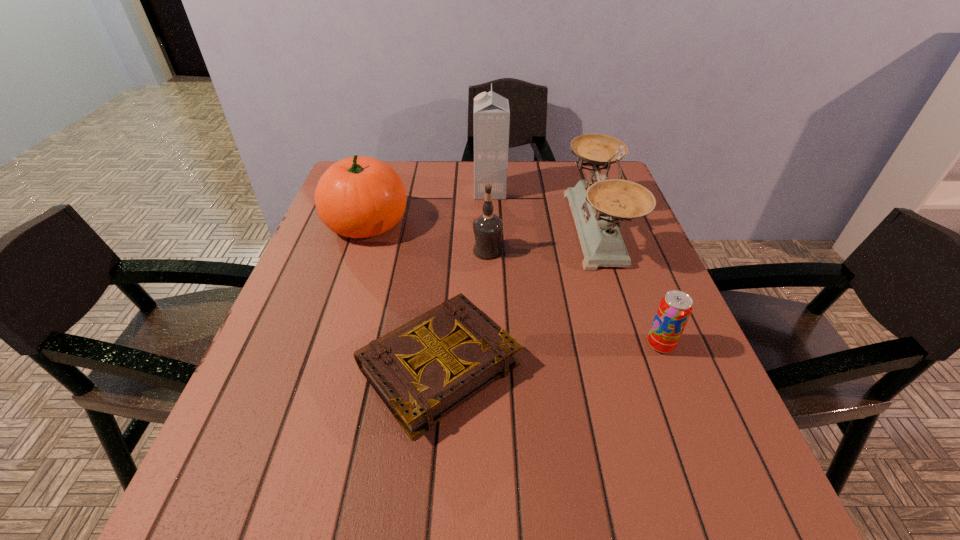
Identify the location of vacant area that lies between the scale and the soda can. (629, 287).

This screenshot has width=960, height=540. What are the coordinates of `free point between the soda can and the scale` in the screenshot? It's located at point(629,287).

Locate an element on the screen. This screenshot has height=540, width=960. free spot between the soda can and the pumpkin is located at coordinates (514, 284).

What are the coordinates of `vacant space in between the pumpkin and the carton` in the screenshot? It's located at (428, 207).

Identify the location of free space between the carton and the scale. This screenshot has height=540, width=960. 543,211.

The height and width of the screenshot is (540, 960). Find the location of `free space between the shortest object and the scale`. free space between the shortest object and the scale is located at coordinates (517, 298).

Identify the location of object that stands as the closest to the second shortest object. This screenshot has height=540, width=960. (598, 207).

Locate which object is the closest to the hardback book. Please provide its 2D coordinates. Your answer should be formatted as a tuple, i.e. [(x, y)], where the tuple contains the x and y coordinates of a point satisfying the conditions above.

[(487, 228)]

This screenshot has width=960, height=540. In order to click on vacant space that satisfies the following two spatial constraints: 1. on the back side of the second shortest object; 2. on the front-facing side of the scale in this screenshot , I will do `click(615, 230)`.

You are a GUI agent. You are given a task and a screenshot of the screen. Output one action in this format:
    pyautogui.click(x=<x>, y=<y>)
    Task: Click on the blank space that satisfies the following two spatial constraints: 1. on the back side of the second shortest object; 2. on the left side of the shortest object
    
    Given the screenshot: What is the action you would take?
    pyautogui.click(x=441, y=345)